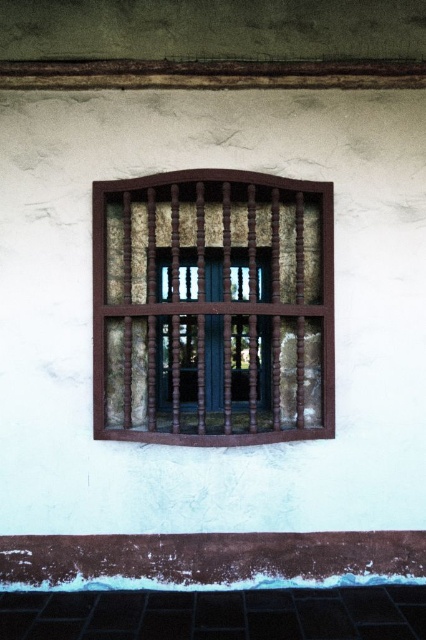
Who is higher up, brown wood at lower center or brown wooden bars at center?

brown wooden bars at center

Who is more forward, (250, 570) or (222, 333)?

Point (250, 570) is in front.

Does point (290, 566) lie in front of point (207, 330)?

Yes, it is in front of point (207, 330).

Identify the location of brown wood at lower center. (210, 556).

Is the position of brown wooden window frame at center more distant than that of brown wooden bars at center?

Yes.

Can you confirm if brown wooden window frame at center is positioned below brown wooden bars at center?

No.

Image resolution: width=426 pixels, height=640 pixels. I want to click on brown wooden window frame at center, so click(x=213, y=308).

The width and height of the screenshot is (426, 640). In order to click on brown wooden window frame at center in this screenshot , I will do `click(213, 308)`.

How far apart are brown wooden window frame at center and brown wood at lower center?

brown wooden window frame at center is 4.36 feet from brown wood at lower center.

Is brown wooden window frame at center taller than brown wood at lower center?

Indeed, brown wooden window frame at center has a greater height compared to brown wood at lower center.

Is point (155, 272) in front of point (236, 548)?

Yes, it is in front of point (236, 548).

Image resolution: width=426 pixels, height=640 pixels. Find the location of `brown wooden window frame at center`. brown wooden window frame at center is located at coordinates (213, 308).